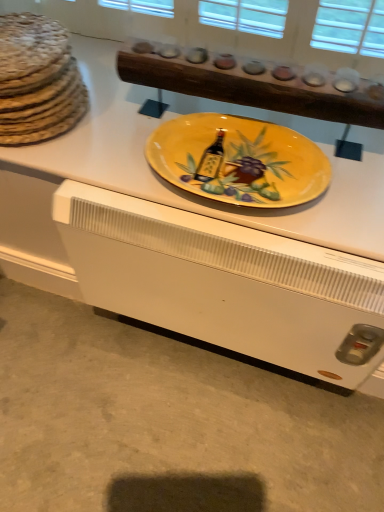
Locate an element on the screen. yellow glossy plate at center is located at coordinates (189, 231).

The image size is (384, 512). Describe the element at coordinates (167, 422) in the screenshot. I see `white matte heater at lower center` at that location.

Identify the location of yellow ceramic plate at center. (238, 160).

How much distance is there between yellow glossy plate at center and brown textured bread at left?

30.80 centimeters.

The height and width of the screenshot is (512, 384). Identify the location of desk below the brown textured bread at left (from the image's perspective). (189, 231).

Which is behind, point (247, 350) or point (26, 98)?

The point (247, 350) is behind.

How many degrees apart are the facing directions of yellow glossy plate at center and brown textured bread at left?

yellow glossy plate at center and brown textured bread at left are facing 3.5 degrees away from each other.

Is point (260, 257) positioned before point (270, 174)?

Yes.

Is the surface of yellow glossy plate at center in direct contact with yellow ceramic plate at center?

No, yellow glossy plate at center is not next to yellow ceramic plate at center.

Is yellow glossy plate at center oriented away from yellow ceramic plate at center?

yellow glossy plate at center is not turned away from yellow ceramic plate at center.

Does yellow glossy plate at center have a greater height compared to yellow ceramic plate at center?

No, yellow glossy plate at center is not taller than yellow ceramic plate at center.

Which of these two, yellow ceramic plate at center or brown textured bread at left, is wider?

Wider between the two is brown textured bread at left.

Does yellow ceramic plate at center touch brown textured bread at left?

They are not placed beside each other.

From the picture: Is yellow ceramic plate at center in front of or behind brown textured bread at left in the image?

Visually, yellow ceramic plate at center is located in front of brown textured bread at left.

From a real-world perspective, is brown textured bread at left located higher than yellow ceramic plate at center?

Yes, from a real-world perspective, brown textured bread at left is above yellow ceramic plate at center.

Considering the relative sizes of brown textured bread at left and yellow ceramic plate at center in the image provided, is brown textured bread at left wider than yellow ceramic plate at center?

Yes.

The width and height of the screenshot is (384, 512). I want to click on plate below the brown textured bread at left (from the image's perspective), so click(x=238, y=160).

Is brown textured bread at left outside of yellow glossy plate at center?

That's correct, brown textured bread at left is outside of yellow glossy plate at center.

Does brown textured bread at left have a larger size compared to yellow glossy plate at center?

Yes.

From a real-world perspective, is white matte heater at lower center physically located above or below yellow ceramic plate at center?

white matte heater at lower center is below yellow ceramic plate at center.

Does white matte heater at lower center touch yellow ceramic plate at center?

→ They are not placed beside each other.

From the picture: Is yellow ceramic plate at center at the back of white matte heater at lower center?

That's not correct — white matte heater at lower center is not looking away from yellow ceramic plate at center.

Can you confirm if white matte heater at lower center is smaller than yellow ceramic plate at center?

No, white matte heater at lower center is not smaller than yellow ceramic plate at center.

Would you consider yellow ceramic plate at center to be distant from yellow glossy plate at center?

No, yellow ceramic plate at center is in close proximity to yellow glossy plate at center.

Which of these two, yellow ceramic plate at center or yellow glossy plate at center, stands shorter?

With less height is yellow glossy plate at center.

How many degrees apart are the facing directions of yellow ceramic plate at center and yellow glossy plate at center?

0.000163 degrees separate the facing orientations of yellow ceramic plate at center and yellow glossy plate at center.

Consider the image. Could you tell me if yellow ceramic plate at center is turned towards yellow glossy plate at center?

No, yellow ceramic plate at center is not aimed at yellow glossy plate at center.

The width and height of the screenshot is (384, 512). In order to click on chocolate cake behind the yellow glossy plate at center in this screenshot , I will do `click(37, 80)`.

Image resolution: width=384 pixels, height=512 pixels. I want to click on desk on the left of yellow ceramic plate at center, so click(x=189, y=231).

Which object lies nearer to the anchor point yellow ceramic plate at center, brown textured bread at left or white matte heater at lower center?

Among the two, brown textured bread at left is located nearer to yellow ceramic plate at center.

When comparing their distances from yellow ceramic plate at center, does yellow glossy plate at center or white matte heater at lower center seem further?

Among the two, white matte heater at lower center is located further to yellow ceramic plate at center.

From the image, which object appears to be farther from brown textured bread at left, white matte heater at lower center or yellow ceramic plate at center?

The object further to brown textured bread at left is white matte heater at lower center.

Based on their spatial positions, is brown textured bread at left or white matte heater at lower center closer to yellow glossy plate at center?

Among the two, brown textured bread at left is located nearer to yellow glossy plate at center.

Based on their spatial positions, is brown textured bread at left or yellow ceramic plate at center closer to white matte heater at lower center?

yellow ceramic plate at center is positioned closer to the anchor white matte heater at lower center.

Estimate the real-world distances between objects in this image. Which object is further from brown textured bread at left, yellow glossy plate at center or white matte heater at lower center?

white matte heater at lower center lies further to brown textured bread at left than the other object.

When comparing their distances from brown textured bread at left, does yellow ceramic plate at center or yellow glossy plate at center seem closer?

The object closer to brown textured bread at left is yellow glossy plate at center.

Estimate the real-world distances between objects in this image. Which object is further from white matte heater at lower center, brown textured bread at left or yellow glossy plate at center?

The object further to white matte heater at lower center is brown textured bread at left.

You are a GUI agent. You are given a task and a screenshot of the screen. Output one action in this format:
    pyautogui.click(x=<x>, y=<y>)
    Task: Click on the desk that lies between brown textured bread at left and white matte heater at lower center from top to bottom
    This screenshot has height=512, width=384.
    Given the screenshot: What is the action you would take?
    pyautogui.click(x=189, y=231)

You are a GUI agent. You are given a task and a screenshot of the screen. Output one action in this format:
    pyautogui.click(x=<x>, y=<y>)
    Task: Click on the desk located between brown textured bread at left and yellow ceramic plate at center in the left-right direction
    The height and width of the screenshot is (512, 384).
    Given the screenshot: What is the action you would take?
    pyautogui.click(x=189, y=231)

Where is `plate that lies between yellow glossy plate at center and white matte heater at lower center from top to bottom`? The height and width of the screenshot is (512, 384). plate that lies between yellow glossy plate at center and white matte heater at lower center from top to bottom is located at coordinates (238, 160).

Where is `plate between brown textured bread at left and white matte heater at lower center in the vertical direction`? This screenshot has width=384, height=512. plate between brown textured bread at left and white matte heater at lower center in the vertical direction is located at coordinates (238, 160).